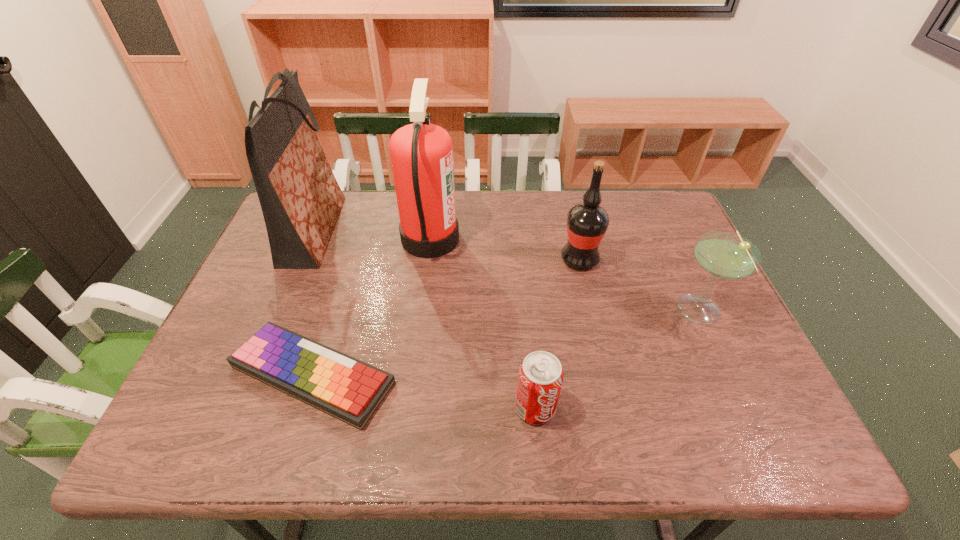
The height and width of the screenshot is (540, 960). In the image, there is a desktop. What are the coordinates of `vacant space at the near right corner` in the screenshot? It's located at point(741,433).

Find the location of a particular element. The image size is (960, 540). free space between the third object from right to left and the computer keyboard is located at coordinates (424, 392).

Find the location of a particular element. The width and height of the screenshot is (960, 540). vacant point located between the fire extinguisher and the shopping bag is located at coordinates (372, 234).

Locate an element on the screen. The height and width of the screenshot is (540, 960). free point between the fire extinguisher and the shortest object is located at coordinates (372, 307).

At what (x,y) coordinates should I click in order to perform the action: click on vacant space in between the computer keyboard and the fire extinguisher. Please return your answer as a coordinate pair (x, y). The width and height of the screenshot is (960, 540). Looking at the image, I should click on (372, 307).

Locate an element on the screen. The width and height of the screenshot is (960, 540). vacant space in between the computer keyboard and the fire extinguisher is located at coordinates (372, 307).

Where is `empty space that is in between the martini and the shortest object`? The width and height of the screenshot is (960, 540). empty space that is in between the martini and the shortest object is located at coordinates (506, 343).

Where is `free space between the martini and the fire extinguisher`? Image resolution: width=960 pixels, height=540 pixels. free space between the martini and the fire extinguisher is located at coordinates (564, 275).

Where is `free spot between the shortest object and the wine bottle`? The image size is (960, 540). free spot between the shortest object and the wine bottle is located at coordinates (446, 317).

Find the location of `unoccupied area between the shortest object and the rightmost object`. unoccupied area between the shortest object and the rightmost object is located at coordinates (506, 343).